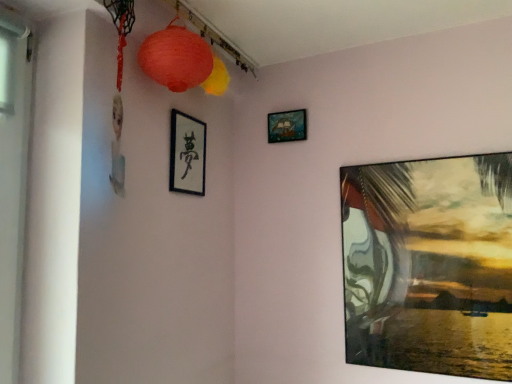
Question: From a real-world perspective, is wooden ship at upper center, the third picture frame positioned from the bottom, physically located above or below matte paper lantern at upper center, which is the 2th lantern in back-to-front order?

Choices:
 (A) below
 (B) above

Answer: (A)

Question: From the image's perspective, is wooden ship at upper center, acting as the 2th picture frame starting from the left, located above or below matte paper lantern at upper center, positioned as the first lantern in front-to-back order?

Choices:
 (A) above
 (B) below

Answer: (B)

Question: Which object is the closest to the matte paper lantern at upper center, which is the 2th lantern in back-to-front order?

Choices:
 (A) matte paper lantern at upper center, the second lantern positioned from the front
 (B) wooden ship at upper center, acting as the 2th picture frame starting from the left
 (C) matte glass painting at right, which is the third picture frame in top-to-bottom order
 (D) black matte picture frame at upper center, which appears as the 2th picture frame when ordered from the bottom

Answer: (A)

Question: Estimate the real-world distances between objects in this image. Which object is farther from the matte paper lantern at upper center, positioned as the first lantern in front-to-back order?

Choices:
 (A) wooden ship at upper center, the 1th picture frame positioned from the top
 (B) matte paper lantern at upper center, arranged as the 1th lantern when viewed from the back
 (C) matte glass painting at right, the third picture frame in the left-to-right sequence
 (D) black matte picture frame at upper center, the first picture frame viewed from the left

Answer: (C)